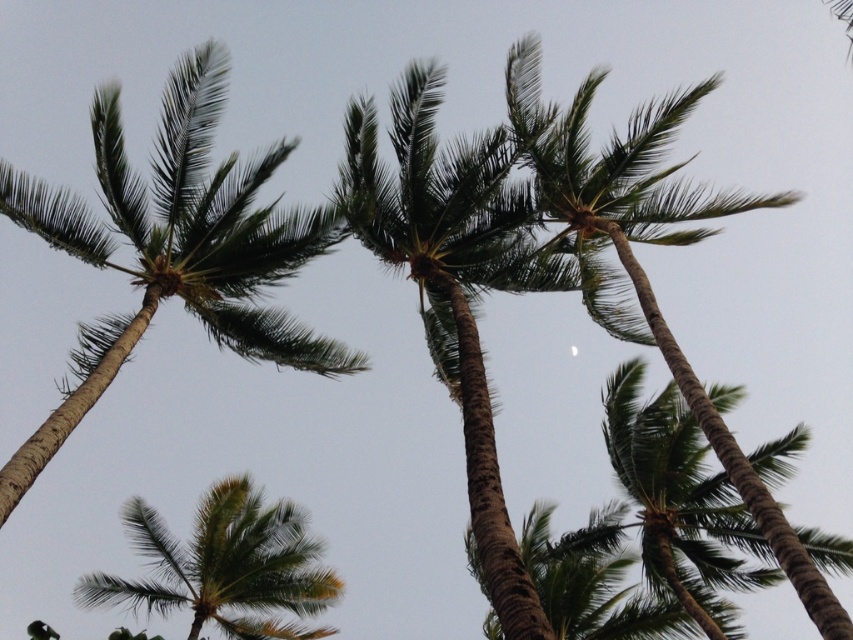
You are standing under the palm trees in the tropical scene. You notice two palm trees in your view. Which one is closer to you, the green textured palm tree at upper right or the green leafy palm tree at lower left?

The green textured palm tree at upper right is closer to you because it is in front of the green leafy palm tree at lower left.

You are standing at the base of the green textured palm tree at upper right and want to take a photo of the moon visible in the sky. Considering the height of the palm tree and your camera position, can you estimate how far you need to walk backward to frame both the tree and the moon in the same shot?

The green textured palm tree at upper right is 62.38 feet away from the camera. To frame both the tree and the moon in the same shot, you would need to step back approximately 62.38 feet to ensure both elements fit within the camera frame.

You are standing at the base of the green leafy coconut tree at upper left and want to take a photo of it with your camera. If the camera is 12.45 meters away from the tree, will you be able to capture the entire tree in one photo without moving the camera?

The green leafy coconut tree at upper left and the camera are 12.45 meters apart. Whether you can capture the entire tree depends on the camera lens and sensor size. However, the distance alone doesn not ensure full capture. You might need a wide angle lens to include the entire tree in the frame at that distance.